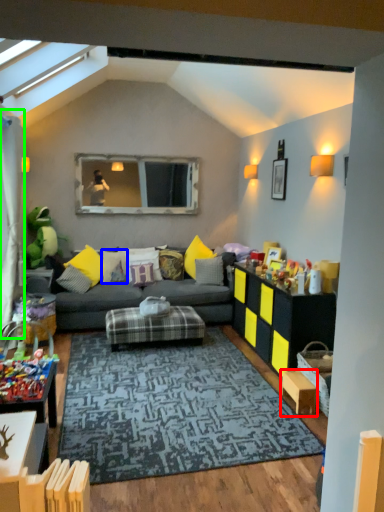
Question: Based on their relative distances, which object is farther from table (highlighted by a red box)? Choose from pillow (highlighted by a blue box) and curtain (highlighted by a green box).

Choices:
 (A) pillow
 (B) curtain

Answer: (B)